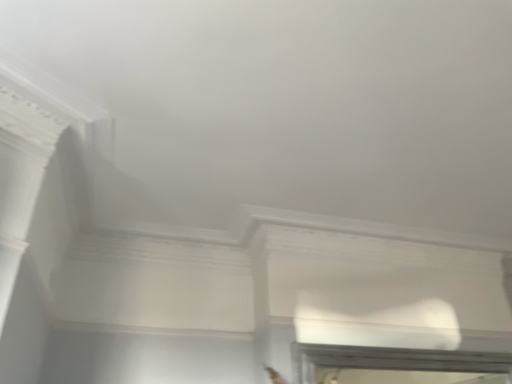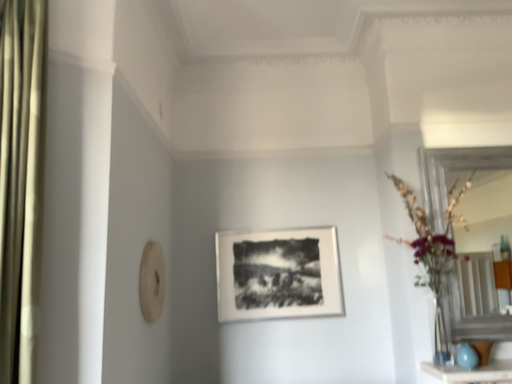
Question: Which way did the camera rotate in the video?

Choices:
 (A) rotated right
 (B) rotated left

Answer: (B)